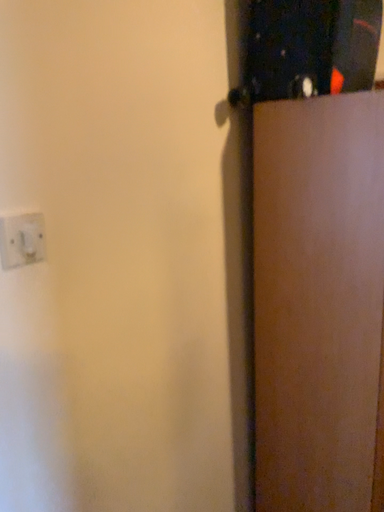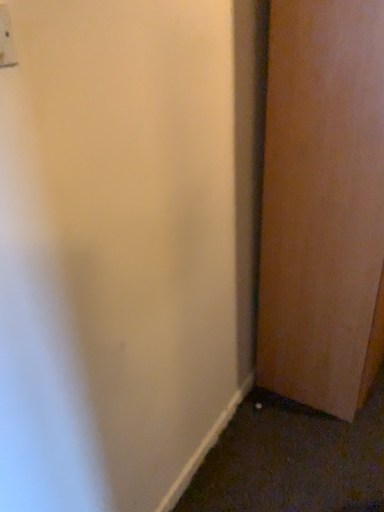
Question: Which way did the camera rotate in the video?

Choices:
 (A) rotated downward
 (B) rotated upward

Answer: (A)